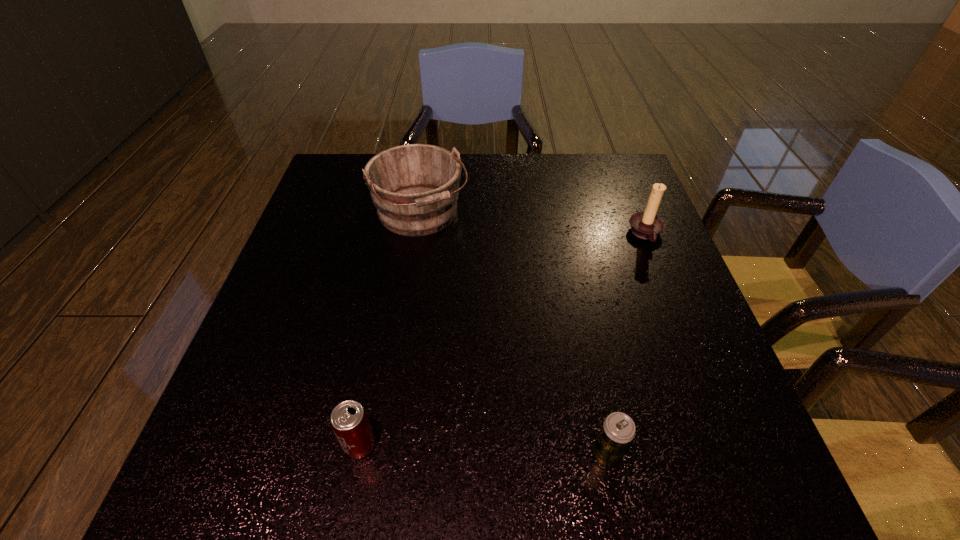
Find the location of `object identified as the third closest to the third object from left to right`. object identified as the third closest to the third object from left to right is located at coordinates (415, 188).

Image resolution: width=960 pixels, height=540 pixels. I want to click on free location that satisfies the following two spatial constraints: 1. on the back side of the wine bucket; 2. on the left side of the left beer can, so click(404, 214).

At what (x,y) coordinates should I click in order to perform the action: click on vacant space that satisfies the following two spatial constraints: 1. on the front side of the left beer can; 2. on the left side of the right beer can. Please return your answer as a coordinate pair (x, y). Looking at the image, I should click on tap(358, 455).

The width and height of the screenshot is (960, 540). I want to click on vacant space that satisfies the following two spatial constraints: 1. on the front side of the right beer can; 2. on the right side of the wine bucket, so click(385, 455).

Where is `free space that satisfies the following two spatial constraints: 1. on the front side of the left beer can; 2. on the right side of the right beer can`? Image resolution: width=960 pixels, height=540 pixels. free space that satisfies the following two spatial constraints: 1. on the front side of the left beer can; 2. on the right side of the right beer can is located at coordinates (358, 455).

This screenshot has height=540, width=960. In order to click on vacant point that satisfies the following two spatial constraints: 1. on the wick of the rightmost object; 2. on the front side of the left beer can in this screenshot , I will do `click(731, 445)`.